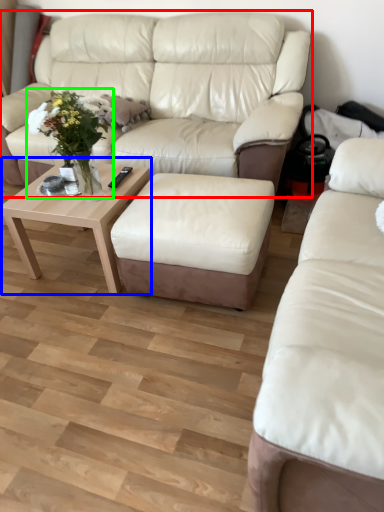
Question: Estimate the real-world distances between objects in this image. Which object is closer to studio couch (highlighted by a red box), coffee table (highlighted by a blue box) or floral arrangement (highlighted by a green box)?

Choices:
 (A) coffee table
 (B) floral arrangement

Answer: (A)